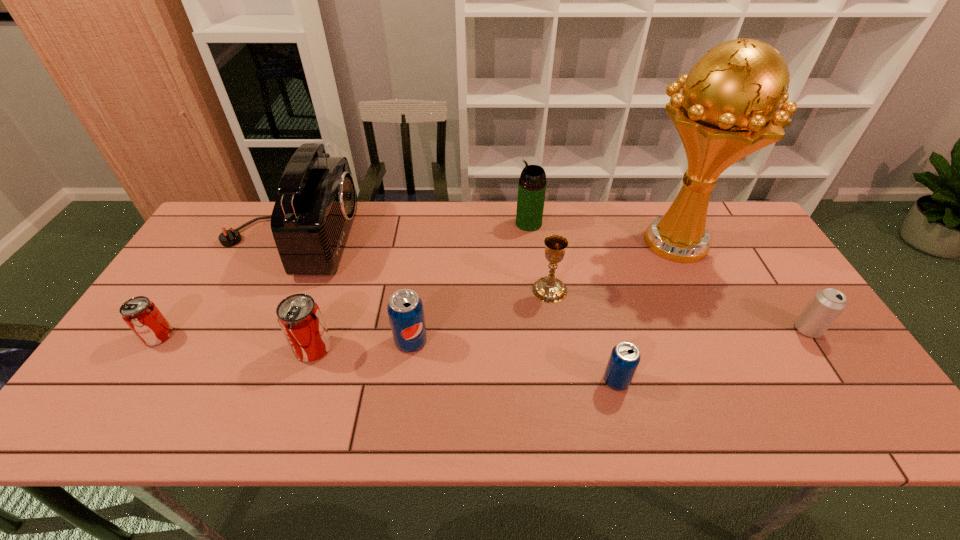
This screenshot has height=540, width=960. I want to click on white beer can, so click(826, 305).

Locate an element on the screen. This screenshot has height=540, width=960. beer can is located at coordinates (826, 305).

Where is `the leftmost pop soda`? the leftmost pop soda is located at coordinates (143, 317).

Where is `the smaller red pop soda`? The height and width of the screenshot is (540, 960). the smaller red pop soda is located at coordinates (143, 317).

The height and width of the screenshot is (540, 960). I want to click on the nearest pop soda, so click(625, 356).

You are a GUI agent. You are given a task and a screenshot of the screen. Output one action in this format:
    pyautogui.click(x=<x>, y=<y>)
    Task: Click on the right blue pop soda
    
    Given the screenshot: What is the action you would take?
    point(625,356)

Image resolution: width=960 pixels, height=540 pixels. I want to click on vacant space positioned 0.180m at the front of the second object from right to left where the globe is prominent, so click(568, 242).

Where is `vacant region located 0.180m at the front of the second object from right to left where the globe is prominent`? The height and width of the screenshot is (540, 960). vacant region located 0.180m at the front of the second object from right to left where the globe is prominent is located at coordinates (568, 242).

Image resolution: width=960 pixels, height=540 pixels. In order to click on vacant space positioned 0.130m at the front of the second object from right to left where the globe is prominent in this screenshot , I will do click(x=585, y=242).

Where is `vacant region located on the front-facing side of the radio receiver`? The width and height of the screenshot is (960, 540). vacant region located on the front-facing side of the radio receiver is located at coordinates (458, 239).